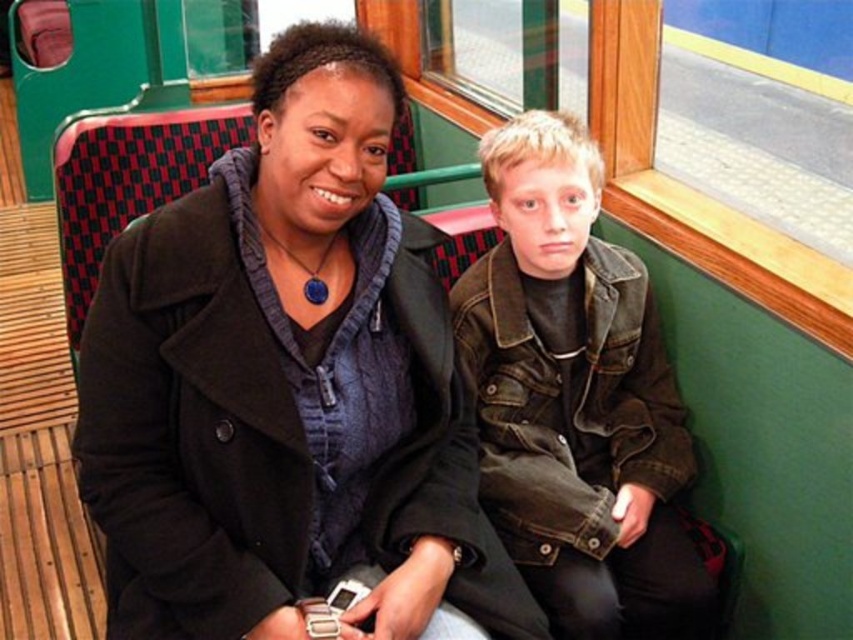
Question: Can you confirm if black woolen coat at center is positioned to the left of denim jacket at center?

Choices:
 (A) no
 (B) yes

Answer: (B)

Question: Is black woolen coat at center bigger than denim jacket at center?

Choices:
 (A) yes
 (B) no

Answer: (A)

Question: Does black woolen coat at center have a greater width compared to denim jacket at center?

Choices:
 (A) no
 (B) yes

Answer: (B)

Question: Among these points, which one is nearest to the camera?

Choices:
 (A) (491, 604)
 (B) (506, 276)

Answer: (A)